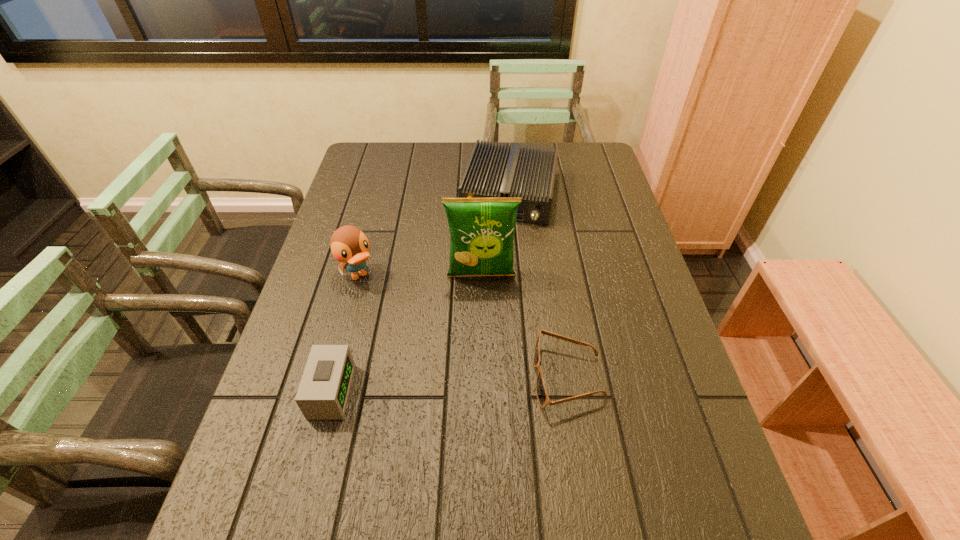
This screenshot has height=540, width=960. Find the location of `the fourth tallest object`. the fourth tallest object is located at coordinates (323, 393).

Where is `sunglasses`? The image size is (960, 540). sunglasses is located at coordinates (541, 392).

You are a GUI agent. You are given a task and a screenshot of the screen. Output one action in this format:
    pyautogui.click(x=<x>, y=<y>)
    Task: Click on the third tallest object
    
    Given the screenshot: What is the action you would take?
    pyautogui.click(x=493, y=171)

Locate an element on the screen. The width and height of the screenshot is (960, 540). the farthest object is located at coordinates tap(493, 171).

Locate an element on the screen. The image size is (960, 540). duck is located at coordinates (349, 245).

Find the location of `the tallest object`. the tallest object is located at coordinates (482, 230).

The width and height of the screenshot is (960, 540). I want to click on free space located on the front-facing side of the fourth tallest object, so click(x=450, y=392).

Locate an element on the screen. The width and height of the screenshot is (960, 540). vacant space located on the frames of the sunglasses is located at coordinates (388, 377).

The height and width of the screenshot is (540, 960). What are the coordinates of `free space located on the frames of the sunglasses` in the screenshot? It's located at (450, 377).

The image size is (960, 540). What are the coordinates of `vacant space located on the frames of the sunglasses` in the screenshot? It's located at (388, 377).